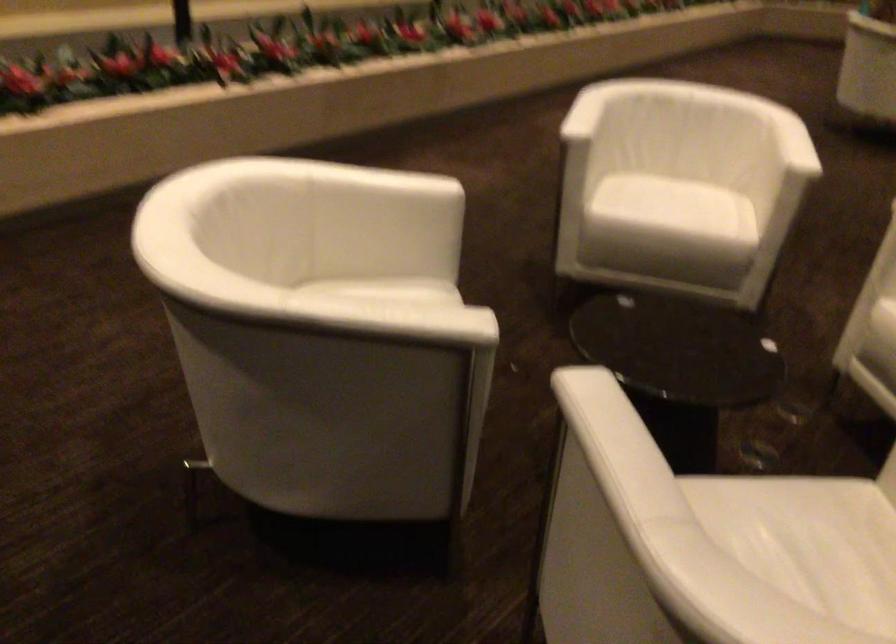
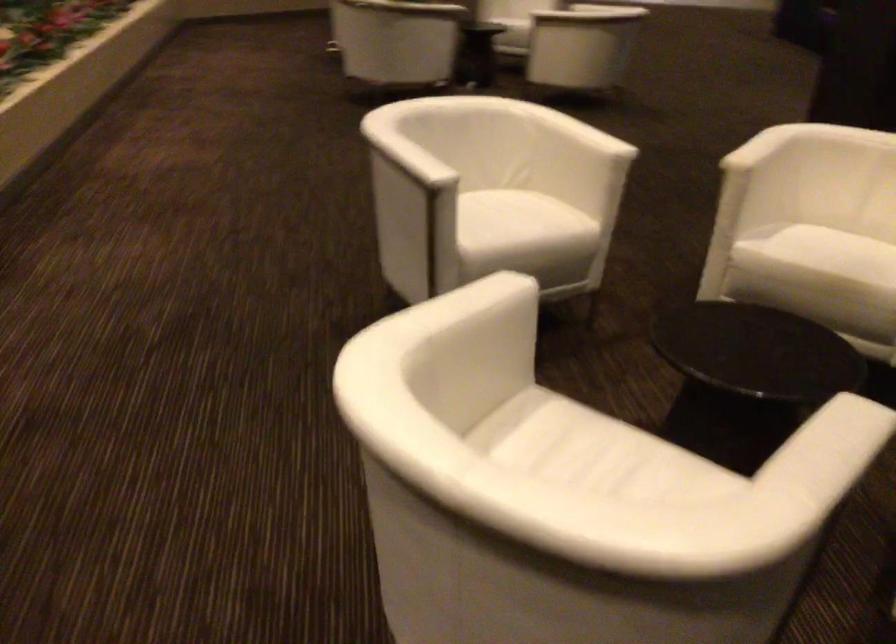
Where in the second image is the point corresponding to [669,191] from the first image?

(502, 214)